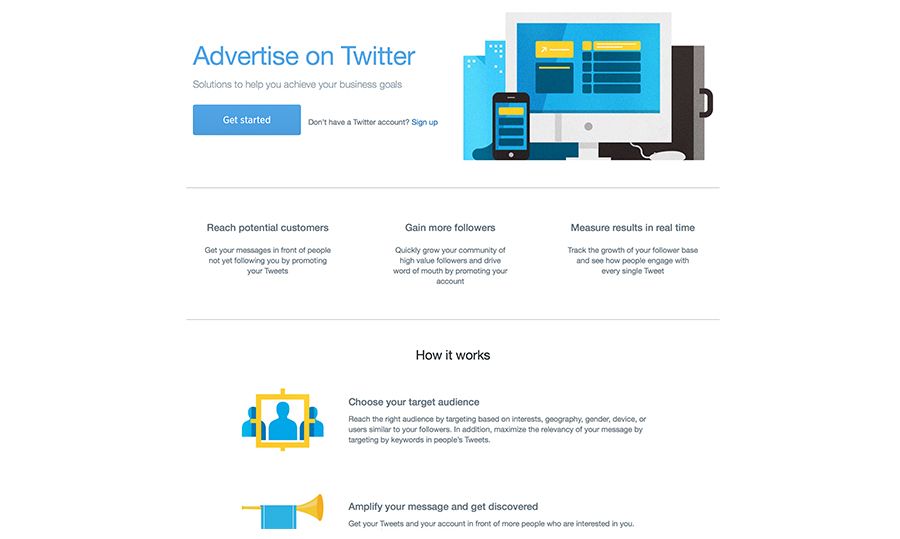
At what (x,y) coordinates should I click in order to perform the action: click on monitor. Please return your answer as a coordinate pair (x, y). Looking at the image, I should click on point(645,88), point(624,137).